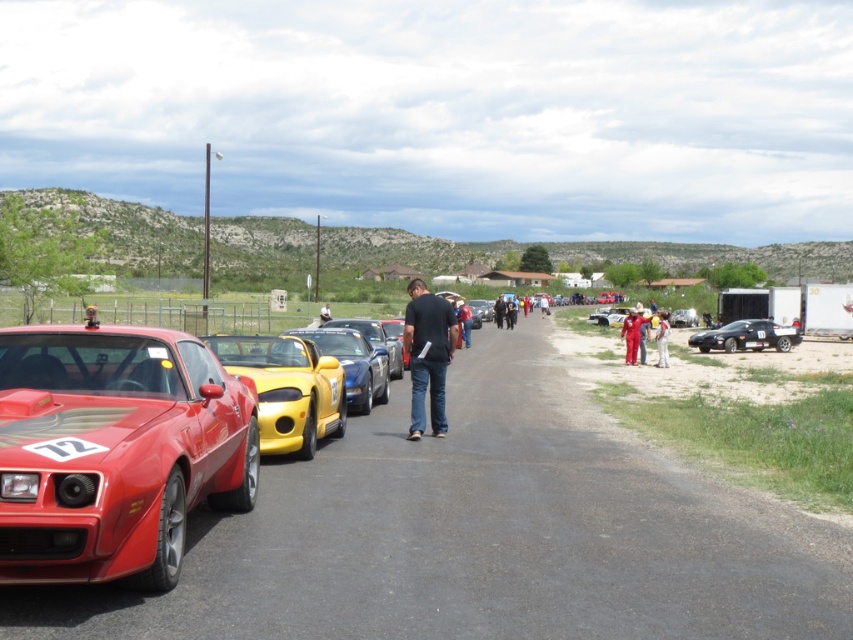
Question: Which is nearer to the shiny yellow car at center?

Choices:
 (A) shiny yellow convertible at center
 (B) matte red jumpsuit at center-right
 (C) white cotton shirt at right
 (D) black cotton shirt at center

Answer: (D)

Question: Which object appears farthest from the camera in this image?

Choices:
 (A) smooth asphalt road at center
 (B) shiny yellow convertible at center
 (C) shiny yellow car at center
 (D) shiny black car at center

Answer: (D)

Question: Can you confirm if black cotton shirt at center is wider than matte red jumpsuit at center-right?

Choices:
 (A) no
 (B) yes

Answer: (A)

Question: Can you confirm if shiny metallic car at center is positioned to the right of blue denim jeans at center?

Choices:
 (A) yes
 (B) no

Answer: (B)

Question: Can you confirm if shiny metallic car at center is wider than matte red jumpsuit at center-right?

Choices:
 (A) no
 (B) yes

Answer: (B)

Question: Among these objects, which one is nearest to the camera?

Choices:
 (A) black cotton shirt at center
 (B) shiny black car at center
 (C) shiny yellow car at center
 (D) shiny red sports car at left

Answer: (D)